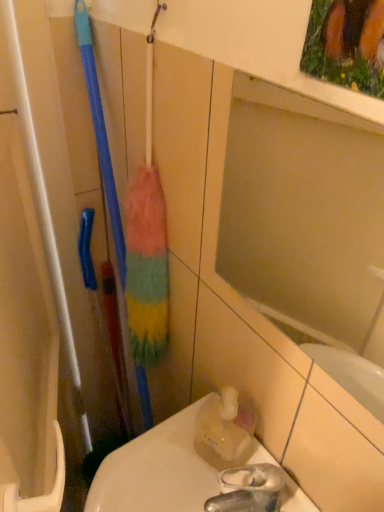
Question: Is translucent plastic bottle at lower right further to the viewer compared to translucent plastic toilet at lower right?

Choices:
 (A) yes
 (B) no

Answer: (A)

Question: Does translucent plastic bottle at lower right have a smaller size compared to translucent plastic toilet at lower right?

Choices:
 (A) yes
 (B) no

Answer: (A)

Question: Is translucent plastic bottle at lower right facing towards translucent plastic toilet at lower right?

Choices:
 (A) yes
 (B) no

Answer: (B)

Question: Does translucent plastic bottle at lower right touch translucent plastic toilet at lower right?

Choices:
 (A) yes
 (B) no

Answer: (A)

Question: Is translucent plastic bottle at lower right to the left of translucent plastic toilet at lower right from the viewer's perspective?

Choices:
 (A) no
 (B) yes

Answer: (A)

Question: Looking at their shapes, would you say matte glass mirror at upper center is wider or thinner than translucent plastic bottle at lower right?

Choices:
 (A) thin
 (B) wide

Answer: (A)

Question: From the image's perspective, is matte glass mirror at upper center positioned above or below translucent plastic bottle at lower right?

Choices:
 (A) below
 (B) above

Answer: (B)

Question: Relative to translucent plastic bottle at lower right, is matte glass mirror at upper center in front or behind?

Choices:
 (A) front
 (B) behind

Answer: (A)

Question: Is matte glass mirror at upper center spatially inside translucent plastic bottle at lower right, or outside of it?

Choices:
 (A) outside
 (B) inside

Answer: (A)

Question: Considering their positions, is translucent plastic toilet at lower right located in front of or behind translucent plastic bottle at lower right?

Choices:
 (A) behind
 (B) front

Answer: (B)

Question: Looking at their shapes, would you say translucent plastic toilet at lower right is wider or thinner than translucent plastic bottle at lower right?

Choices:
 (A) thin
 (B) wide

Answer: (B)

Question: From their relative heights in the image, would you say translucent plastic toilet at lower right is taller or shorter than translucent plastic bottle at lower right?

Choices:
 (A) short
 (B) tall

Answer: (A)

Question: From the image's perspective, is translucent plastic toilet at lower right above or below translucent plastic bottle at lower right?

Choices:
 (A) below
 (B) above

Answer: (A)

Question: Which is correct: translucent plastic bottle at lower right is inside matte glass mirror at upper center, or outside of it?

Choices:
 (A) outside
 (B) inside

Answer: (A)

Question: Based on their positions, is translucent plastic bottle at lower right located to the left or right of matte glass mirror at upper center?

Choices:
 (A) right
 (B) left

Answer: (B)